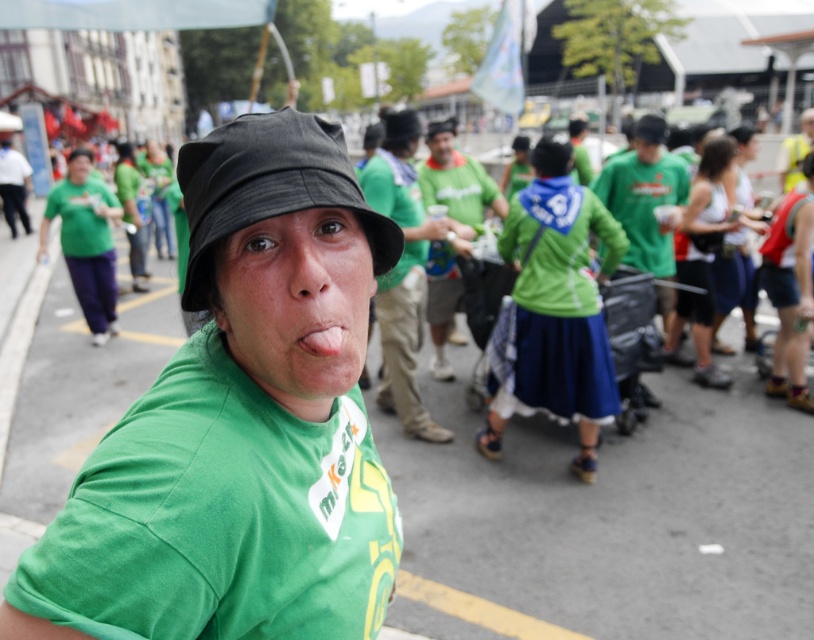
Is black fabric hat at center to the left of white fabric tank top at right from the viewer's perspective?

Indeed, black fabric hat at center is positioned on the left side of white fabric tank top at right.

Does black fabric hat at center have a smaller size compared to white fabric tank top at right?

Correct, black fabric hat at center occupies less space than white fabric tank top at right.

Is point (209, 172) closer to camera compared to point (685, 241)?

That is True.

This screenshot has width=814, height=640. Identify the location of black fabric hat at center. (268, 188).

Is green matte shirt at center bigger than pink flesh at center?

Indeed, green matte shirt at center has a larger size compared to pink flesh at center.

Does green matte shirt at center appear under pink flesh at center?

Yes.

This screenshot has height=640, width=814. Describe the element at coordinates (239, 424) in the screenshot. I see `green matte shirt at center` at that location.

The height and width of the screenshot is (640, 814). Identify the location of green matte shirt at center. (239, 424).

Which is behind, point (279, 572) or point (270, 131)?

Positioned behind is point (279, 572).

Is point (98, 609) positioned in front of point (244, 208)?

Yes, it is.

Which is in front, point (252, 465) or point (195, 172)?

Point (252, 465)

The width and height of the screenshot is (814, 640). Find the location of `green matte shirt at center`. green matte shirt at center is located at coordinates (239, 424).